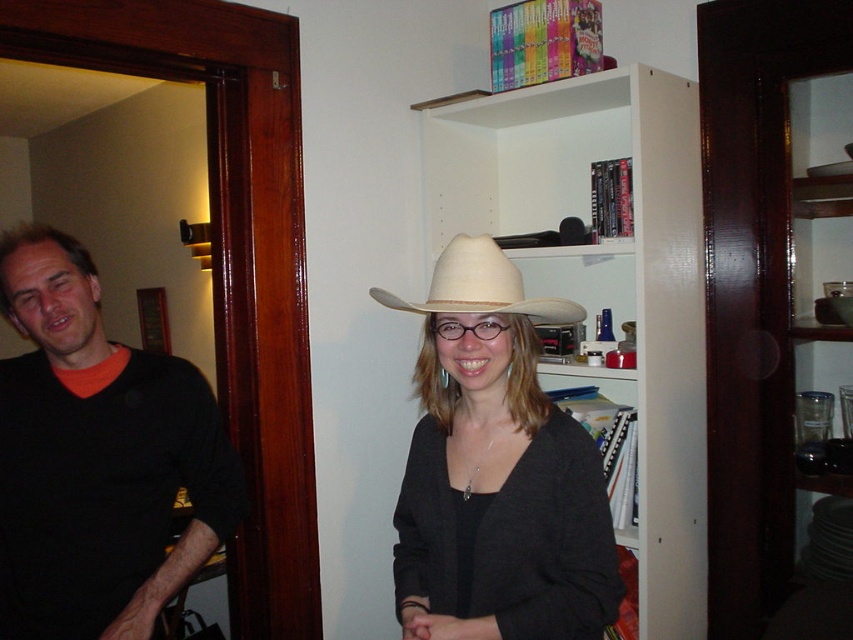
You are standing in the room and want to place a small plant pot that is 0.3 meters in diameter on the matte white cowboy hat at center. Is there enough space?

The matte white cowboy hat at center is located at point (496, 472), so the plant pot with 0.3 meters diameter can be placed there as long as the surface is flat and stable.